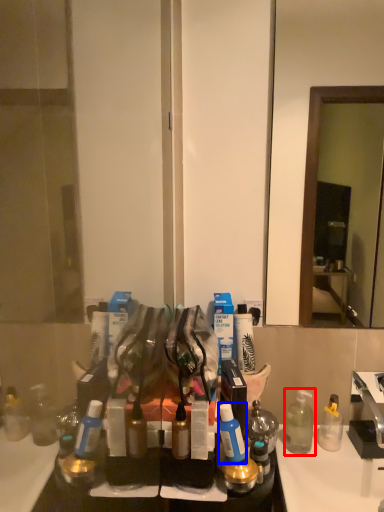
Question: Which object appears farthest to the camera in this image, bottle (highlighted by a red box) or toiletry (highlighted by a blue box)?

Choices:
 (A) bottle
 (B) toiletry

Answer: (A)